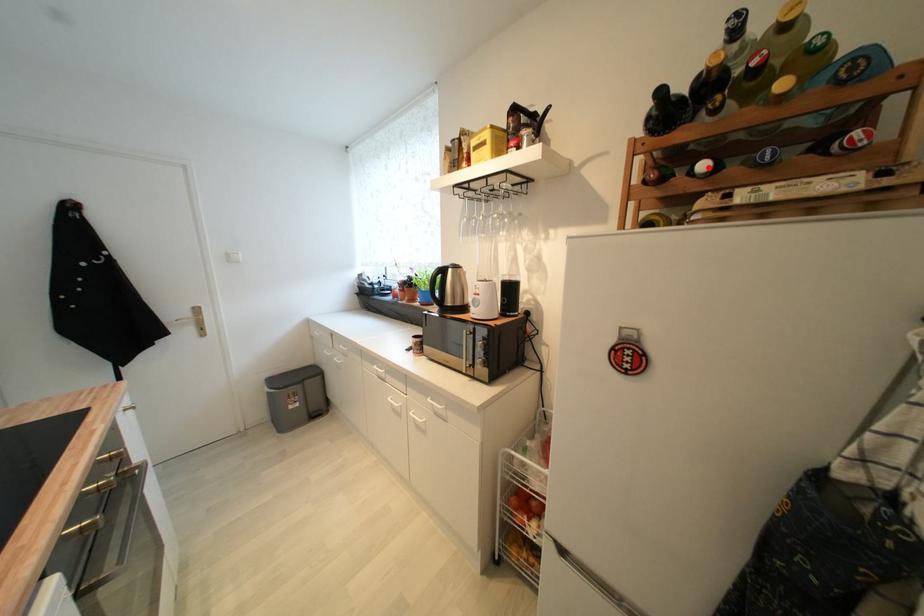
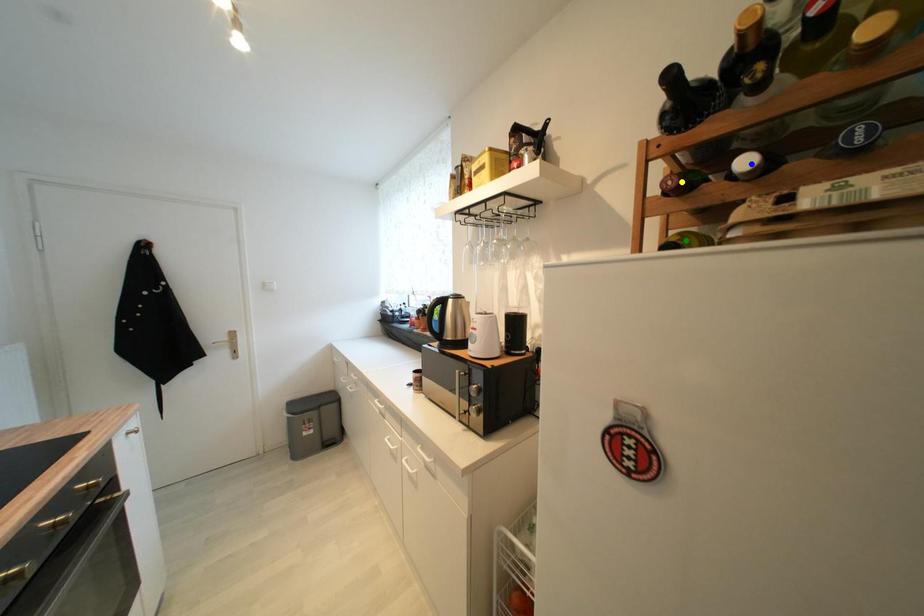
Question: I am providing you with two images of the same scene from different viewpoints. A red point is marked on the first image. You are given multiple points on the second image. In image 2, which mark is for the same physical point as the one in image 1?

Choices:
 (A) yellow point
 (B) green point
 (C) blue point

Answer: (C)